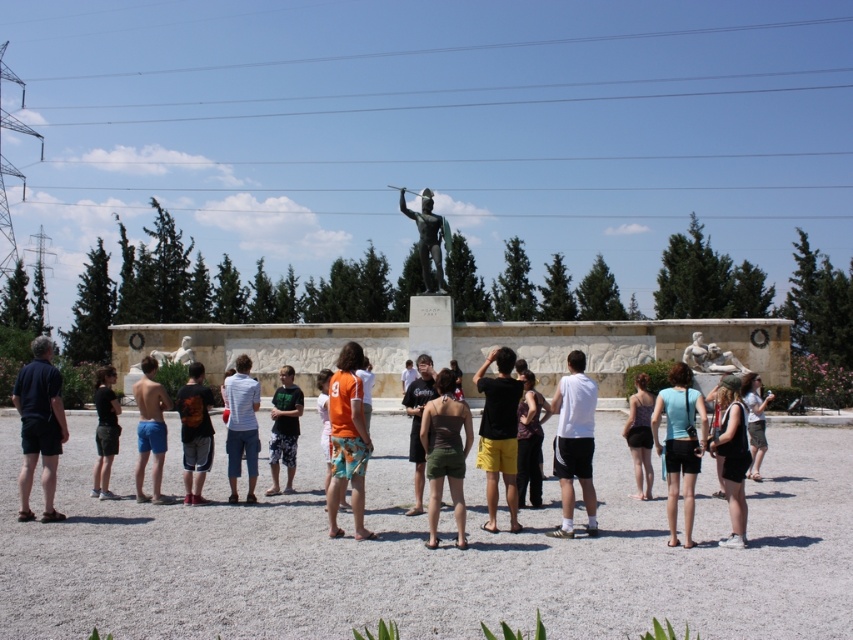
Consider the image. Is white matte shirt at center thinner than black tank top at center?

Yes, white matte shirt at center is thinner than black tank top at center.

In the scene shown: Does white matte shirt at center have a greater height compared to black tank top at center?

Yes, white matte shirt at center is taller than black tank top at center.

Which is in front, point (560, 392) or point (730, 541)?

Point (730, 541) is in front.

The width and height of the screenshot is (853, 640). I want to click on white matte shirt at center, so click(x=573, y=442).

Between point (196, 365) and point (521, 486), which one is positioned behind?

Positioned behind is point (196, 365).

Looking at this image, can you confirm if dark orange t-shirt at center is smaller than patterned fabric dress at center?

No.

Where is `dark orange t-shirt at center`? The height and width of the screenshot is (640, 853). dark orange t-shirt at center is located at coordinates (195, 433).

Identify the location of dark orange t-shirt at center. The image size is (853, 640). (195, 433).

Does point (467, 435) come closer to viewer compared to point (517, 465)?

Yes, it is in front of point (517, 465).

The height and width of the screenshot is (640, 853). What do you see at coordinates (445, 452) in the screenshot? I see `matte brown tank top at center` at bounding box center [445, 452].

Image resolution: width=853 pixels, height=640 pixels. Describe the element at coordinates (445, 452) in the screenshot. I see `matte brown tank top at center` at that location.

What are the coordinates of `matte brown tank top at center` in the screenshot? It's located at (445, 452).